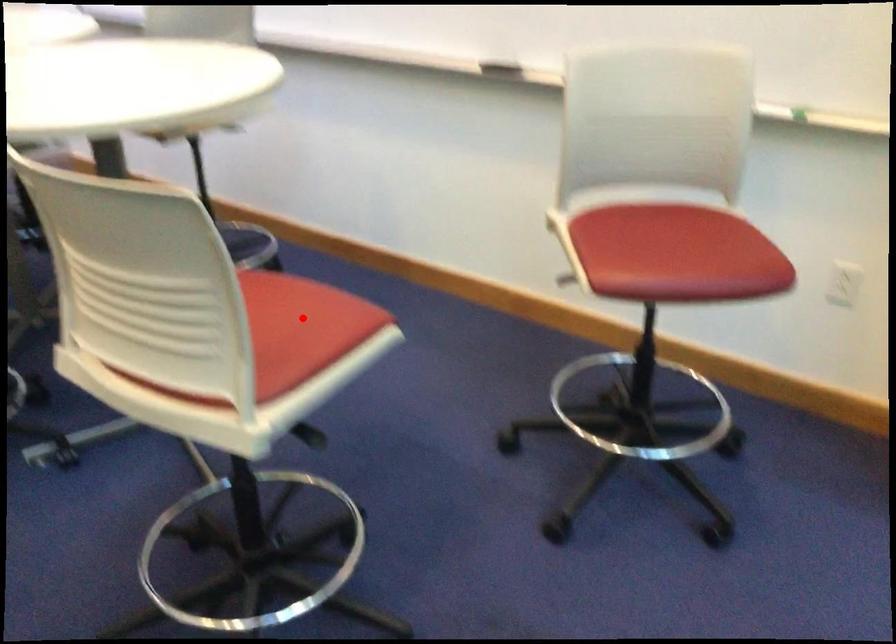
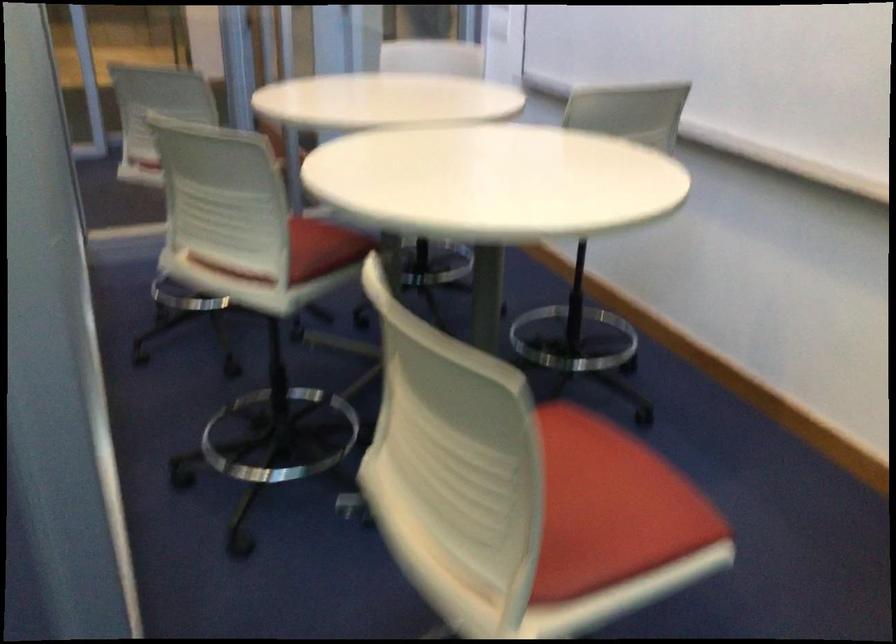
Question: I am providing you with two images of the same scene from different viewpoints. Image1 has a red point marked. In image2, the corresponding 3D location appears at what relative position? Reply with the corresponding letter.

Choices:
 (A) Closer
 (B) Farther

Answer: (A)